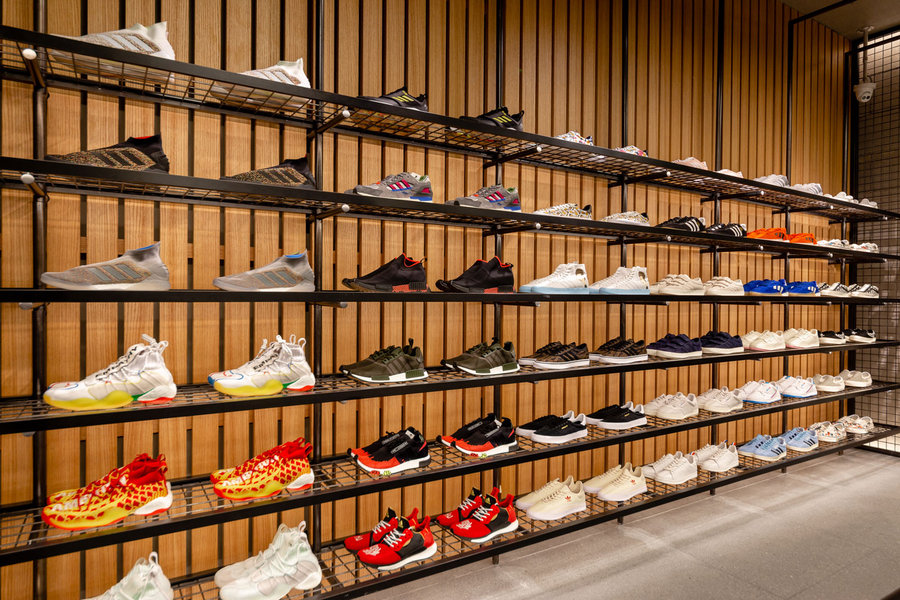
You are a GUI agent. You are given a task and a screenshot of the screen. Output one action in this format:
    pyautogui.click(x=<x>, y=<y>)
    Task: Click on the shelves
    The width and height of the screenshot is (900, 600).
    Given the screenshot: What is the action you would take?
    pyautogui.click(x=355, y=579), pyautogui.click(x=343, y=481), pyautogui.click(x=337, y=392), pyautogui.click(x=340, y=296), pyautogui.click(x=340, y=199), pyautogui.click(x=346, y=101)